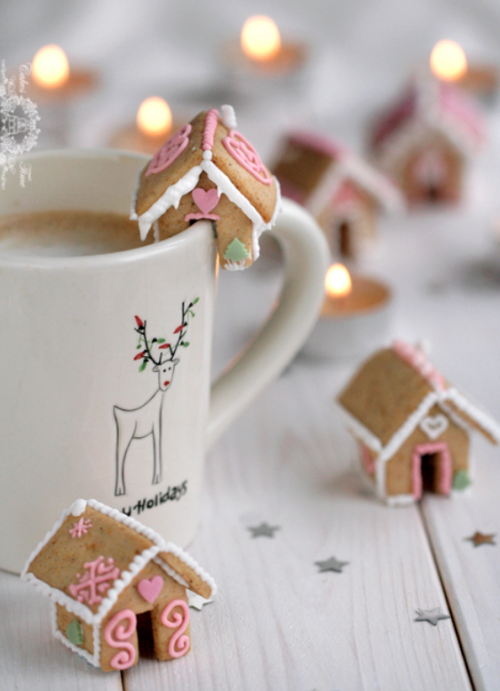
Where is `5 candle lights`? The height and width of the screenshot is (691, 500). 5 candle lights is located at coordinates (40, 64), (340, 272), (156, 117), (272, 39), (449, 77).